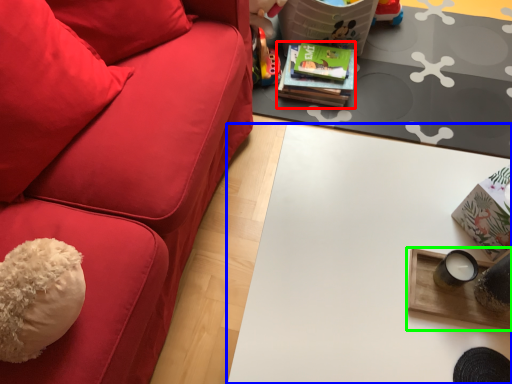
Question: Which object is the farthest from magazine (highlighted by a red box)? Choose among these: table (highlighted by a blue box) or table (highlighted by a green box).

Choices:
 (A) table
 (B) table

Answer: (B)